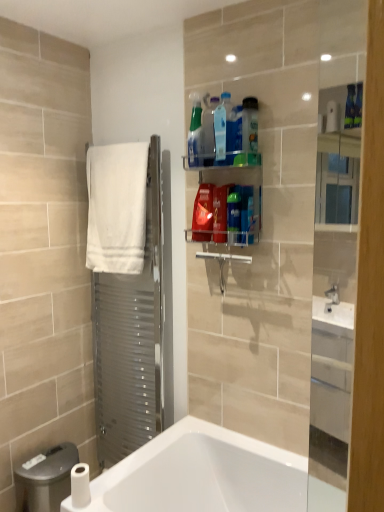
Question: Is translucent plastic bottle at upper center, arranged as the third cleaning product when viewed from the right, located outside translucent plastic spray bottle at upper center, which is the 8th cleaning product from right to left?

Choices:
 (A) no
 (B) yes

Answer: (B)

Question: Does translucent plastic bottle at upper center, the sixth cleaning product when ordered from left to right, come behind translucent plastic spray bottle at upper center, which is the 8th cleaning product from right to left?

Choices:
 (A) no
 (B) yes

Answer: (B)

Question: Does translucent plastic bottle at upper center, the sixth cleaning product when ordered from left to right, have a lesser height compared to translucent plastic spray bottle at upper center, which is the 8th cleaning product from right to left?

Choices:
 (A) no
 (B) yes

Answer: (B)

Question: Considering the relative sizes of translucent plastic bottle at upper center, the sixth cleaning product when ordered from left to right, and translucent plastic spray bottle at upper center, which is the 8th cleaning product from right to left, in the image provided, is translucent plastic bottle at upper center, the sixth cleaning product when ordered from left to right, taller than translucent plastic spray bottle at upper center, which is the 8th cleaning product from right to left,?

Choices:
 (A) no
 (B) yes

Answer: (A)

Question: From the image's perspective, is translucent plastic bottle at upper center, arranged as the third cleaning product when viewed from the right, on top of translucent plastic spray bottle at upper center, which ranks as the 1th cleaning product in left-to-right order?

Choices:
 (A) no
 (B) yes

Answer: (A)

Question: Is translucent plastic spray bottle at upper center, which is the 8th cleaning product from right to left, located within translucent plastic bottle at upper center, arranged as the third cleaning product when viewed from the right?

Choices:
 (A) no
 (B) yes

Answer: (A)

Question: Is white soft towel at left at the left side of translucent plastic bottle at upper center, arranged as the third cleaning product when viewed from the right?

Choices:
 (A) no
 (B) yes

Answer: (B)

Question: Is white soft towel at left completely or partially outside of translucent plastic bottle at upper center, the sixth cleaning product when ordered from left to right?

Choices:
 (A) no
 (B) yes

Answer: (B)

Question: Is translucent plastic bottle at upper center, the sixth cleaning product when ordered from left to right, a part of white soft towel at left?

Choices:
 (A) yes
 (B) no

Answer: (B)

Question: Is white soft towel at left behind translucent plastic bottle at upper center, the sixth cleaning product when ordered from left to right?

Choices:
 (A) no
 (B) yes

Answer: (B)

Question: From a real-world perspective, is white soft towel at left on translucent plastic bottle at upper center, arranged as the third cleaning product when viewed from the right?

Choices:
 (A) yes
 (B) no

Answer: (A)

Question: Would you consider white soft towel at left to be distant from translucent plastic bottle at upper center, the sixth cleaning product when ordered from left to right?

Choices:
 (A) yes
 (B) no

Answer: (B)

Question: Does translucent plastic spray bottle at upper center, the seventh cleaning product viewed from the left, have a larger size compared to translucent plastic spray bottle at upper center, which is the 5th cleaning product from right to left?

Choices:
 (A) no
 (B) yes

Answer: (A)